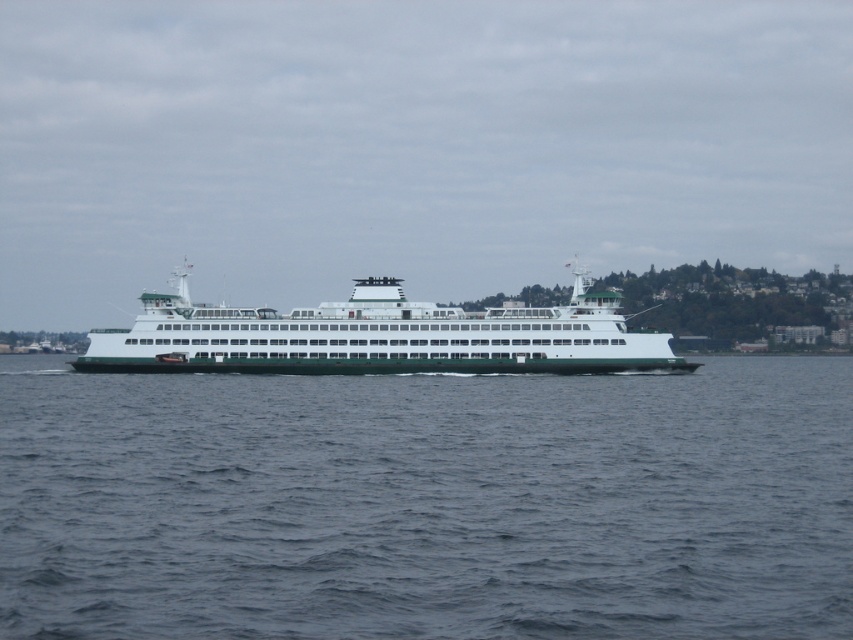
Does blue water at center appear on the right side of green matte ferry at center?

Yes, blue water at center is to the right of green matte ferry at center.

Which is more to the right, blue water at center or green matte ferry at center?

blue water at center is more to the right.

Does point (814, 529) come in front of point (151, 340)?

Yes.

Where is `blue water at center`? blue water at center is located at coordinates (427, 502).